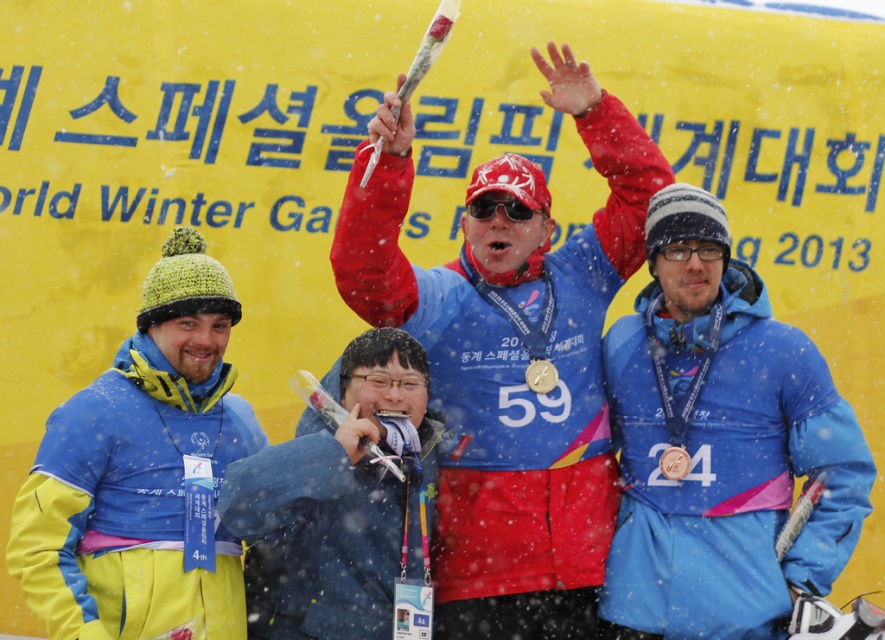
From the picture: You are a photographer standing at the camera position. You want to zoom in on the yellow fleece jacket at left to capture its details. Is the jacket within your camera range if your camera can zoom up to 50 meters?

The yellow fleece jacket at left is 50.78 meters from camera, which is slightly beyond the camera range of 50 meters. You cannot zoom in to capture its details.

You are a photographer trying to capture a group photo of the athletes. You notice the blue synthetic jacket at center and the yellow fleece jacket at left. Which jacket should you adjust in the frame to ensure both are fully visible? Please explain your reasoning based on their positions and sizes.

The blue synthetic jacket at center might be wider than the yellow fleece jacket at left. To ensure both are fully visible in the frame, you should adjust the blue synthetic jacket at center, as its width could be obstructing the view of the yellow fleece jacket at left.